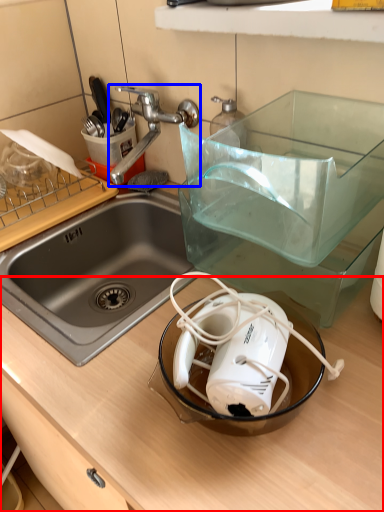
Question: Among these objects, which one is nearest to the camera, counter top (highlighted by a red box) or tap (highlighted by a blue box)?

Choices:
 (A) counter top
 (B) tap

Answer: (A)